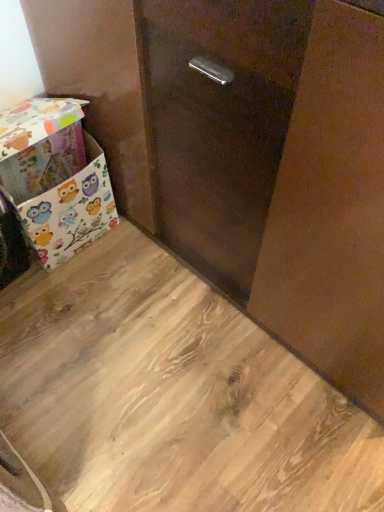
Question: From the image's perspective, is owl-patterned fabric box at lower left positioned above or below wooden floor at lower left?

Choices:
 (A) below
 (B) above

Answer: (B)

Question: Considering the positions of owl-patterned fabric box at lower left and wooden floor at lower left in the image, is owl-patterned fabric box at lower left wider or thinner than wooden floor at lower left?

Choices:
 (A) wide
 (B) thin

Answer: (B)

Question: In terms of height, does owl-patterned fabric box at lower left look taller or shorter compared to wooden floor at lower left?

Choices:
 (A) tall
 (B) short

Answer: (A)

Question: Based on their sizes in the image, would you say wooden floor at lower left is bigger or smaller than owl-patterned fabric box at lower left?

Choices:
 (A) big
 (B) small

Answer: (B)

Question: Do you think wooden floor at lower left is within owl-patterned fabric box at lower left, or outside of it?

Choices:
 (A) outside
 (B) inside

Answer: (A)

Question: From the image's perspective, relative to owl-patterned fabric box at lower left, is wooden floor at lower left above or below?

Choices:
 (A) below
 (B) above

Answer: (A)

Question: From a real-world perspective, relative to owl-patterned fabric box at lower left, is wooden floor at lower left vertically above or below?

Choices:
 (A) below
 (B) above

Answer: (A)